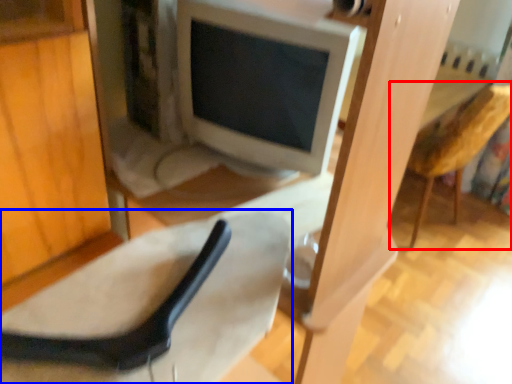
Question: Among these objects, which one is nearest to the camera, armchair (highlighted by a red box) or chair (highlighted by a blue box)?

Choices:
 (A) armchair
 (B) chair

Answer: (B)